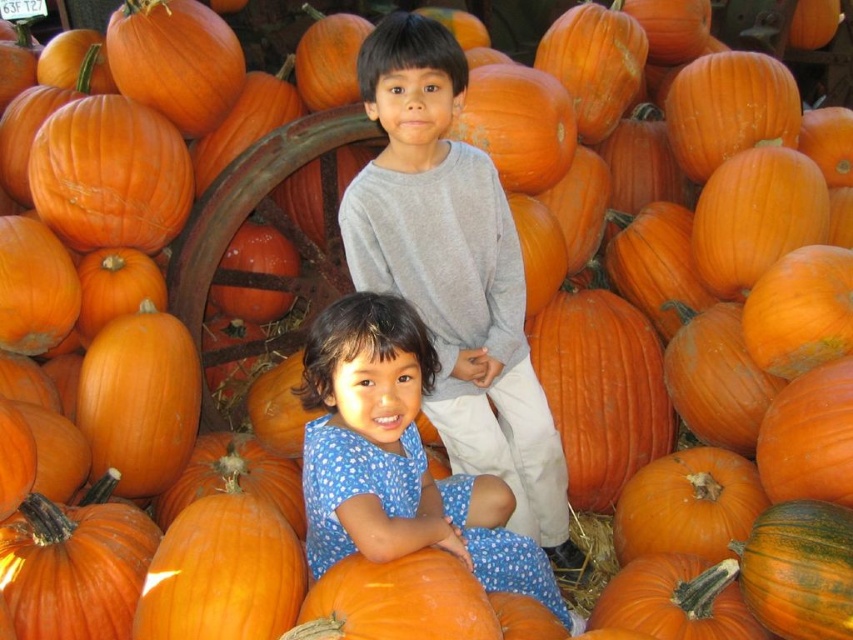
Between gray cotton shirt at center and blue dotted dress at center, which one appears on the left side from the viewer's perspective?

blue dotted dress at center

This screenshot has height=640, width=853. What do you see at coordinates (454, 273) in the screenshot? I see `gray cotton shirt at center` at bounding box center [454, 273].

In order to click on gray cotton shirt at center in this screenshot , I will do `click(454, 273)`.